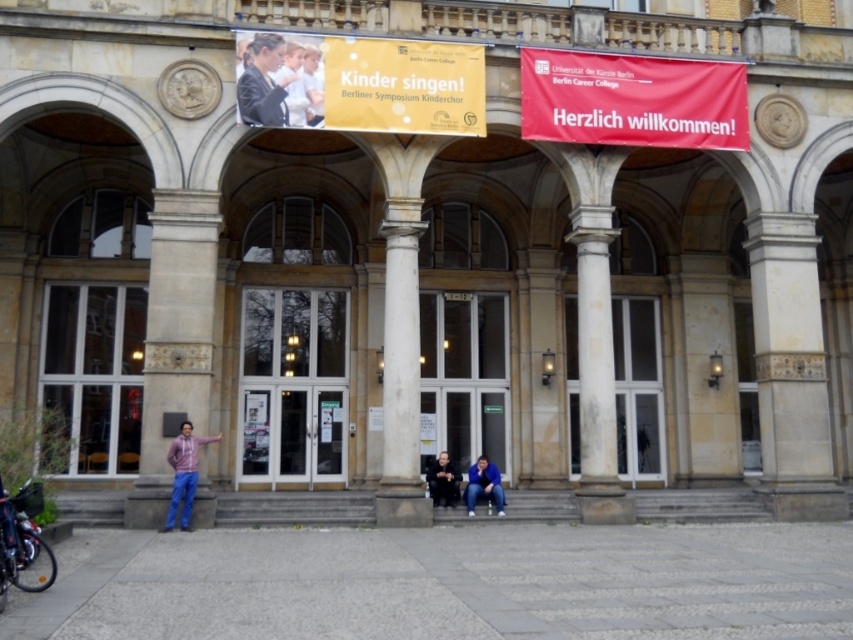
Can you confirm if beige stone column at left is positioned to the right of white marble column at center?

Incorrect, beige stone column at left is not on the right side of white marble column at center.

Between beige stone column at left and white marble column at center, which one has less height?

beige stone column at left

Is point (163, 397) positioned after point (387, 436)?

No.

Image resolution: width=853 pixels, height=640 pixels. What are the coordinates of `beige stone column at left` in the screenshot? It's located at (175, 337).

Between white marble column at center and blue fabric jacket at lower center, which one has more height?

With more height is white marble column at center.

Consider the image. Is white marble column at center thinner than blue fabric jacket at lower center?

In fact, white marble column at center might be wider than blue fabric jacket at lower center.

Where is `white marble column at center`? The image size is (853, 640). white marble column at center is located at coordinates (401, 371).

Based on the photo, does white marble column at center have a lesser width compared to matte pink hoodie at center?

No.

Can you confirm if white marble column at center is positioned below matte pink hoodie at center?

No.

Between point (389, 371) and point (175, 460), which one is positioned in front?

Positioned in front is point (175, 460).

At what (x,y) coordinates should I click in order to perform the action: click on white marble column at center. Please return your answer as a coordinate pair (x, y). The width and height of the screenshot is (853, 640). Looking at the image, I should click on (401, 371).